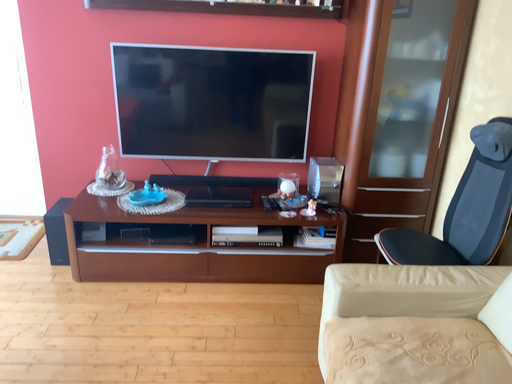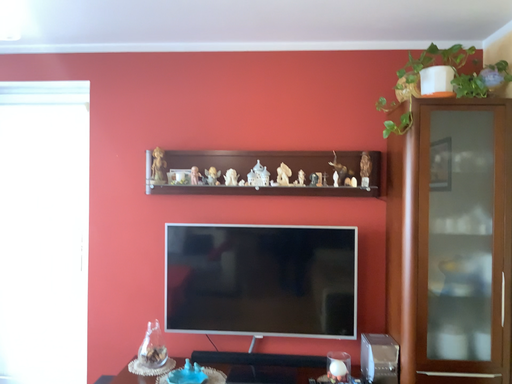
Question: How did the camera likely rotate when shooting the video?

Choices:
 (A) rotated downward
 (B) rotated upward

Answer: (B)